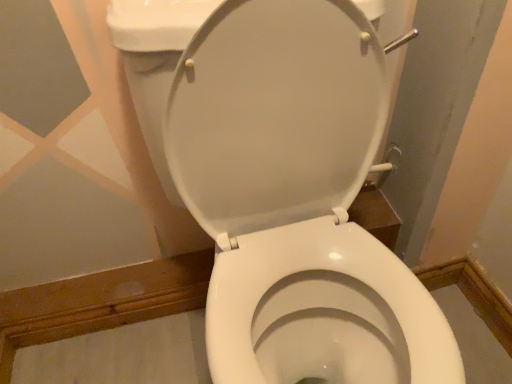
Where is `white glossy toilet at center`? The width and height of the screenshot is (512, 384). white glossy toilet at center is located at coordinates (285, 187).

This screenshot has height=384, width=512. What do you see at coordinates (285, 187) in the screenshot?
I see `white glossy toilet at center` at bounding box center [285, 187].

Identify the location of white glossy toilet at center. Image resolution: width=512 pixels, height=384 pixels. pos(285,187).